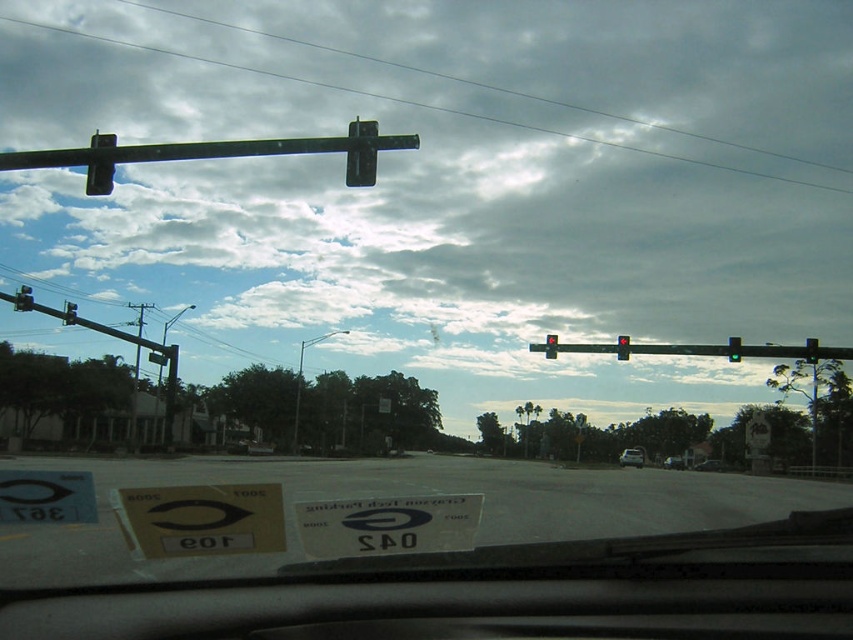
Consider the image. You are driving a car and see the point marked at coordinates point (x=625, y=353) through your windshield. Based on the distance, can you safely pass through that point without hitting any obstacles?

The point (x=625, y=353) is 40.57 meters away from the viewer, so you can safely pass through it without hitting obstacles.

You are driving a car and need to check the traffic lights ahead. According to the scene, which traffic light is closer to your windshield between the black plastic traffic light at upper center and the metallic traffic light at upper left?

The black plastic traffic light at upper center is closer to the viewer than the metallic traffic light at upper left, so it would be closer to your windshield.

Consider the image. You are driving a car and see the red glass traffic light at upper center ahead. If your car can stop within 100 feet, will you be able to stop before reaching it?

The red glass traffic light at upper center is 132.27 feet away from the viewer. Since your car can stop within 100 feet, you will not be able to stop before reaching it.